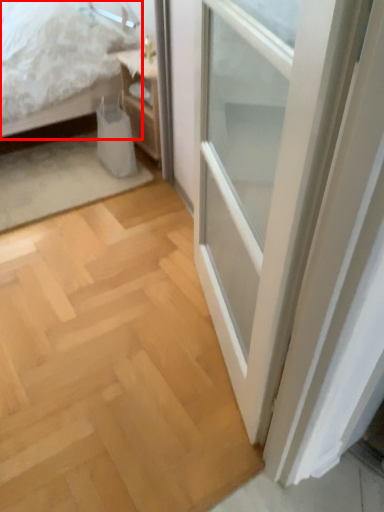
Question: Observing the image, what is the correct spatial positioning of bed (annotated by the red box) in reference to nightstand?

Choices:
 (A) right
 (B) left

Answer: (B)